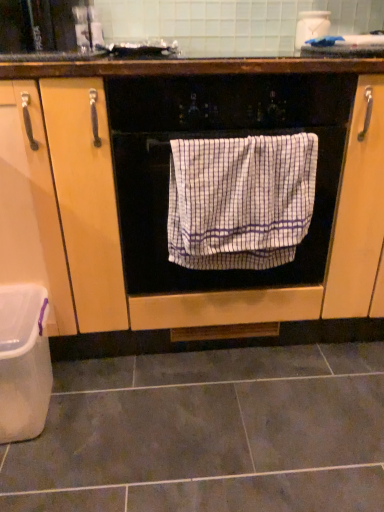
This screenshot has height=512, width=384. What do you see at coordinates (23, 362) in the screenshot? I see `white plastic container at lower left` at bounding box center [23, 362].

This screenshot has height=512, width=384. Find the location of `white plastic container at lower left`. white plastic container at lower left is located at coordinates (23, 362).

At what (x,y) coordinates should I click in order to perform the action: click on white checkered towel at center. Please return your answer as a coordinate pair (x, y). The height and width of the screenshot is (512, 384). Looking at the image, I should click on (240, 200).

Consider the image. Which is closer to the camera, (222,121) or (273,170)?

Clearly, point (222,121) is closer to the camera than point (273,170).

Which object is closer to the camera, white checkered towel at center or white checkered towel at center?

white checkered towel at center is in front.

Consider the image. Is white checkered towel at center turned away from white checkered towel at center?

Yes, white checkered towel at center is positioned with its back facing white checkered towel at center.

Can you tell me how much white checkered towel at center and white checkered towel at center differ in facing direction?

The angle between the facing direction of white checkered towel at center and the facing direction of white checkered towel at center is 0.000726 degrees.

Is white checkered towel at center situated inside white plastic container at lower left or outside?

white checkered towel at center is spatially situated outside white plastic container at lower left.

Is white checkered towel at center beside white plastic container at lower left?

No, white checkered towel at center is not making contact with white plastic container at lower left.

In terms of height, does white checkered towel at center look taller or shorter compared to white plastic container at lower left?

Considering their sizes, white checkered towel at center has more height than white plastic container at lower left.

Considering the positions of objects white checkered towel at center and white plastic container at lower left in the image provided, who is more to the left, white checkered towel at center or white plastic container at lower left?

white plastic container at lower left.

Is point (255, 321) farther from camera compared to point (275, 181)?

Yes, point (255, 321) is farther from viewer.

Is white wood cabinet at center bigger than white checkered towel at center?

Yes.

Is white wood cabinet at center facing towards white checkered towel at center?

Yes, white wood cabinet at center is oriented towards white checkered towel at center.

From the image's perspective, which one is positioned lower, white wood cabinet at center or white checkered towel at center?

white checkered towel at center, from the image's perspective.

In the image, is white wood cabinet at center on the left side or the right side of white checkered towel at center?

Based on their positions, white wood cabinet at center is located to the right of white checkered towel at center.

I want to click on oven that appears behind the white wood cabinet at center, so click(x=212, y=138).

Can we say white wood cabinet at center lies outside white checkered towel at center?

white wood cabinet at center lies outside white checkered towel at center's area.

Is white wood cabinet at center taller than white checkered towel at center?

Correct, white wood cabinet at center is much taller as white checkered towel at center.

Considering the sizes of objects white plastic container at lower left and white checkered towel at center in the image provided, who is taller, white plastic container at lower left or white checkered towel at center?

Standing taller between the two is white checkered towel at center.

From the image's perspective, which one is positioned higher, white plastic container at lower left or white checkered towel at center?

white checkered towel at center.

Is white plastic container at lower left far away from white checkered towel at center?

white plastic container at lower left is near white checkered towel at center, not far away.

From a real-world perspective, is white plastic container at lower left above or below white checkered towel at center?

In terms of real-world spatial position, white plastic container at lower left is below white checkered towel at center.

Does white wood cabinet at center appear on the left side of white plastic container at lower left?

No, white wood cabinet at center is not to the left of white plastic container at lower left.

Is white wood cabinet at center further to the viewer compared to white plastic container at lower left?

No.

Is white plastic container at lower left at the back of white wood cabinet at center?

No, white wood cabinet at center is not facing away from white plastic container at lower left.

Is there a large distance between white wood cabinet at center and white plastic container at lower left?

No.

Could you tell me if gray matte tile at lower center is facing white checkered towel at center?

No.

Is white checkered towel at center located within gray matte tile at lower center?

Actually, white checkered towel at center is outside gray matte tile at lower center.

Does point (175, 475) appear closer or farther from the camera than point (305, 188)?

Point (175, 475) is positioned closer to the camera compared to point (305, 188).

Identify the location of oven on the left of white checkered towel at center. This screenshot has width=384, height=512. (212, 138).

The height and width of the screenshot is (512, 384). Identify the location of dish washer in front of the white checkered towel at center. (23, 362).

From the image, which object appears to be farther from white checkered towel at center, white wood cabinet at center or white plastic container at lower left?

white plastic container at lower left is positioned further to the anchor white checkered towel at center.

Estimate the real-world distances between objects in this image. Which object is further from white wood cabinet at center, gray matte tile at lower center or white checkered towel at center?

The object further to white wood cabinet at center is gray matte tile at lower center.

When comparing their distances from white checkered towel at center, does white plastic container at lower left or white wood cabinet at center seem further?

Among the two, white plastic container at lower left is located further to white checkered towel at center.

When comparing their distances from white plastic container at lower left, does white wood cabinet at center or gray matte tile at lower center seem further?

Among the two, white wood cabinet at center is located further to white plastic container at lower left.

Based on their spatial positions, is white plastic container at lower left or white checkered towel at center further from white checkered towel at center?

Based on the image, white plastic container at lower left appears to be further to white checkered towel at center.

Looking at the image, which one is located closer to white wood cabinet at center, white checkered towel at center or white plastic container at lower left?

white checkered towel at center is closer to white wood cabinet at center.

Based on their spatial positions, is white wood cabinet at center or white plastic container at lower left further from gray matte tile at lower center?

white wood cabinet at center is positioned further to the anchor gray matte tile at lower center.

Considering their positions, is white checkered towel at center positioned closer to white checkered towel at center than white wood cabinet at center?

Result: white checkered towel at center is closer to white checkered towel at center.

The height and width of the screenshot is (512, 384). What are the coordinates of `cabinetry between white plastic container at lower left and white checkered towel at center` in the screenshot? It's located at pos(167,192).

Locate an element on the screen. The width and height of the screenshot is (384, 512). bath towel between white wood cabinet at center and gray matte tile at lower center vertically is located at coordinates (240, 200).

The height and width of the screenshot is (512, 384). What are the coordinates of `oven situated between white plastic container at lower left and white wood cabinet at center from left to right` in the screenshot? It's located at (212, 138).

The width and height of the screenshot is (384, 512). In order to click on bath towel between white checkered towel at center and gray matte tile at lower center vertically in this screenshot , I will do `click(240, 200)`.